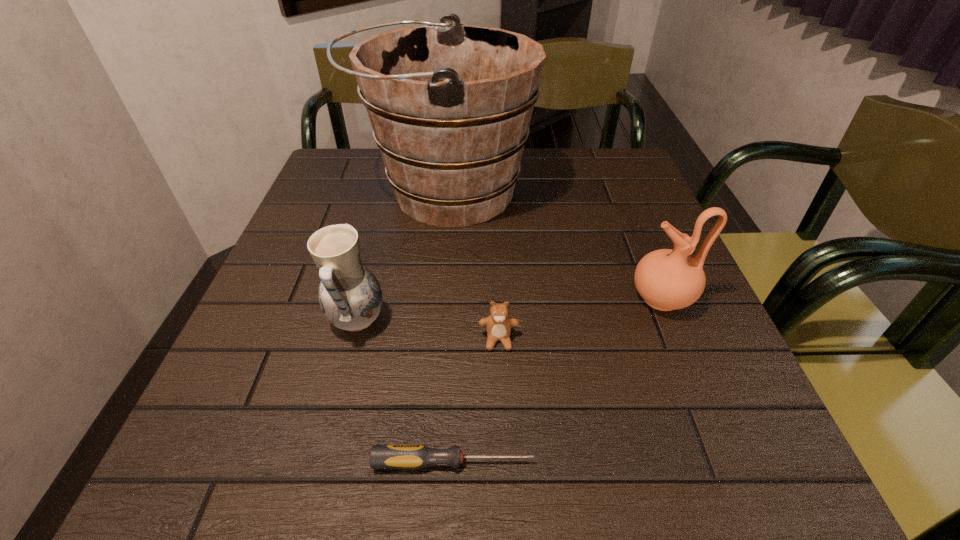
Where is `vacant space located on the spout of the right pottery`? This screenshot has height=540, width=960. vacant space located on the spout of the right pottery is located at coordinates (426, 298).

Locate an element on the screen. The width and height of the screenshot is (960, 540). free space located on the spout of the right pottery is located at coordinates (446, 298).

The height and width of the screenshot is (540, 960). I want to click on free space located on either side of the left pottery, so click(x=563, y=321).

Identify the location of vacant space situated on the front-facing side of the fourth tallest object. (504, 489).

Find the location of a particular element. Image resolution: width=960 pixels, height=540 pixels. free space located insert the nearest object into a screw head is located at coordinates click(583, 462).

At what (x,y) coordinates should I click in order to perform the action: click on object that is positioned at the far edge. Please return your answer as a coordinate pair (x, y). Looking at the image, I should click on (450, 105).

This screenshot has height=540, width=960. I want to click on object that is at the near edge, so click(415, 456).

The height and width of the screenshot is (540, 960). What are the coordinates of `bucket that is positioned at the left edge` in the screenshot? It's located at (450, 105).

At what (x,y) coordinates should I click in order to perform the action: click on pottery that is at the left edge. Please return your answer as a coordinate pair (x, y). Looking at the image, I should click on (350, 297).

Where is `object that is at the right edge`? object that is at the right edge is located at coordinates (666, 279).